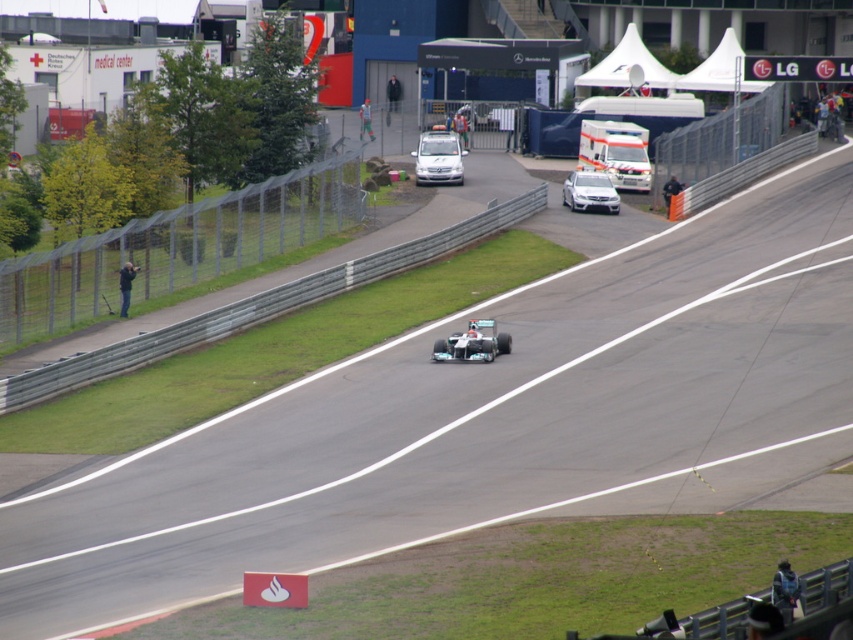
You are a race official who needs to ensure that all vehicles on the track comply with the maximum width regulation of 2 meters. You observe the white matte race car at center and the satin silver sedan at center. Based on the available information, can you determine if either vehicle exceeds the width limit?

The white matte race car at center might be wider than the satin silver sedan at center, but without exact measurements, it is uncertain whether either exceeds the 2 meter limit. Further measurements are needed to confirm compliance.

You are a race official standing at the camera position. You need to reach the white matte van at center quickly. What is the shortest distance you must cover to reach it?

The shortest distance you must cover to reach the white matte van at center is 86.45 meters.